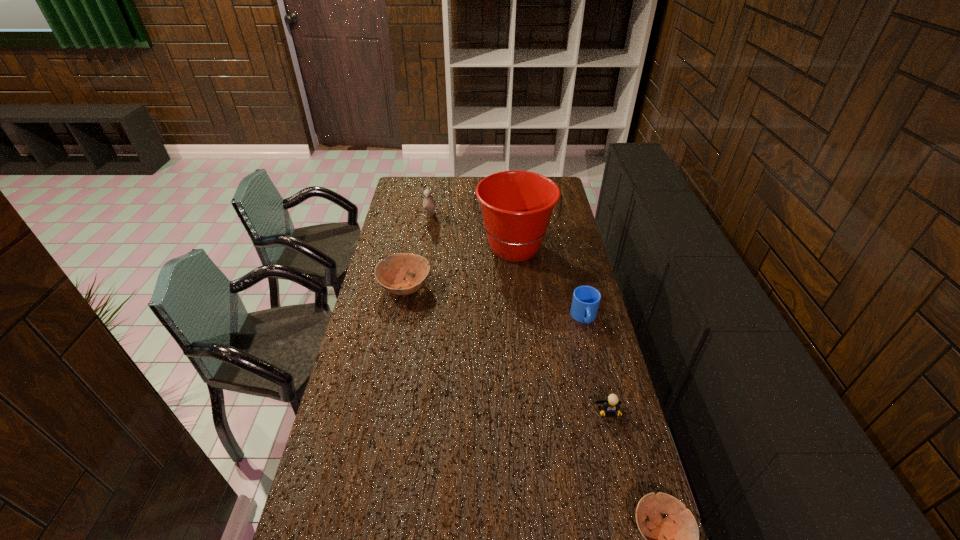
Where is `the farther bowl`? This screenshot has height=540, width=960. the farther bowl is located at coordinates (391, 278).

You are a GUI agent. You are given a task and a screenshot of the screen. Output one action in this format:
    pyautogui.click(x=<x>, y=<y>)
    Task: Click on the left bowl
    This screenshot has height=540, width=960.
    Given the screenshot: What is the action you would take?
    pyautogui.click(x=391, y=278)

You are a GUI agent. You are given a task and a screenshot of the screen. Output one action in this format:
    pyautogui.click(x=<x>, y=<y>)
    Task: Click on the fifth shortest object
    This screenshot has height=540, width=960.
    Given the screenshot: What is the action you would take?
    pyautogui.click(x=429, y=204)

The image size is (960, 540). Find the location of `mug`. mug is located at coordinates (586, 299).

The width and height of the screenshot is (960, 540). I want to click on the fourth object from right to left, so click(x=516, y=205).

Identify the location of bucket. This screenshot has height=540, width=960. coord(516,205).

Where is `the fifth farthest object`? This screenshot has height=540, width=960. the fifth farthest object is located at coordinates (610, 406).

Image resolution: width=960 pixels, height=540 pixels. In order to click on free space located on the front of the taller bowl in this screenshot , I will do `click(396, 332)`.

Where is `vacant region located 0.240m at the beak of the fifth shortest object`? Image resolution: width=960 pixels, height=540 pixels. vacant region located 0.240m at the beak of the fifth shortest object is located at coordinates (424, 259).

Where is `free space located on the side of the mug with the handle`? free space located on the side of the mug with the handle is located at coordinates (596, 368).